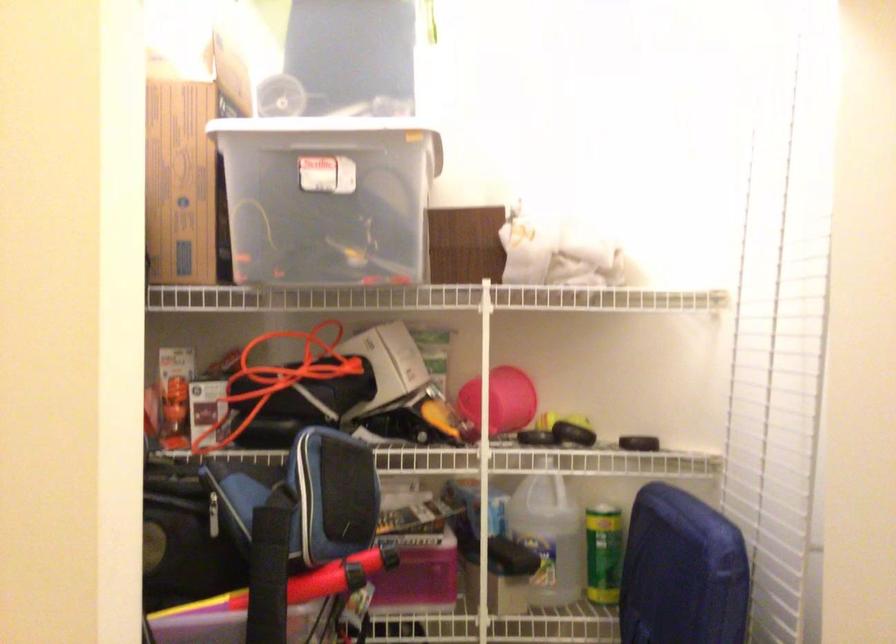
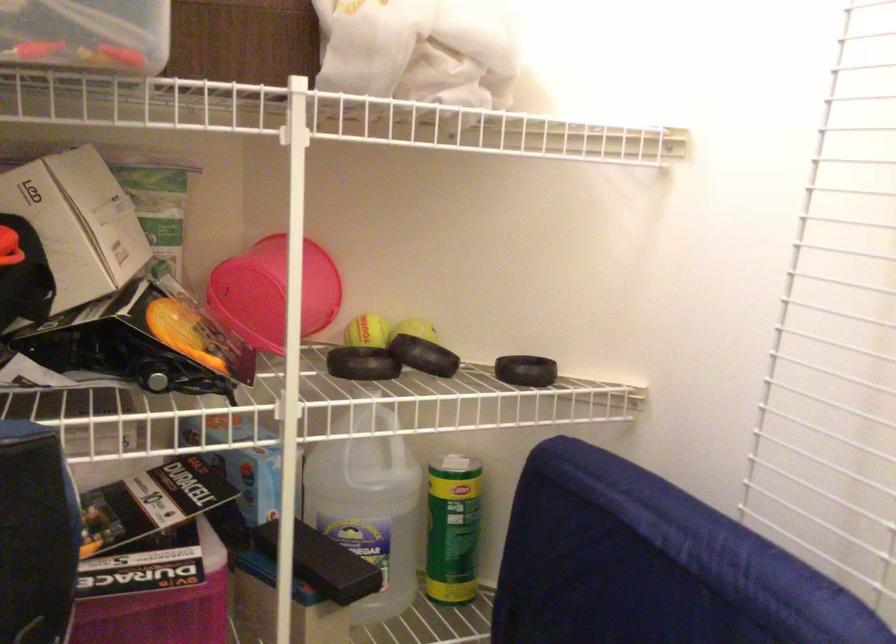
Question: The images are taken continuously from a first-person perspective. In which direction are you moving?

Choices:
 (A) Left
 (B) Right
 (C) Forward
 (D) Backward

Answer: (C)